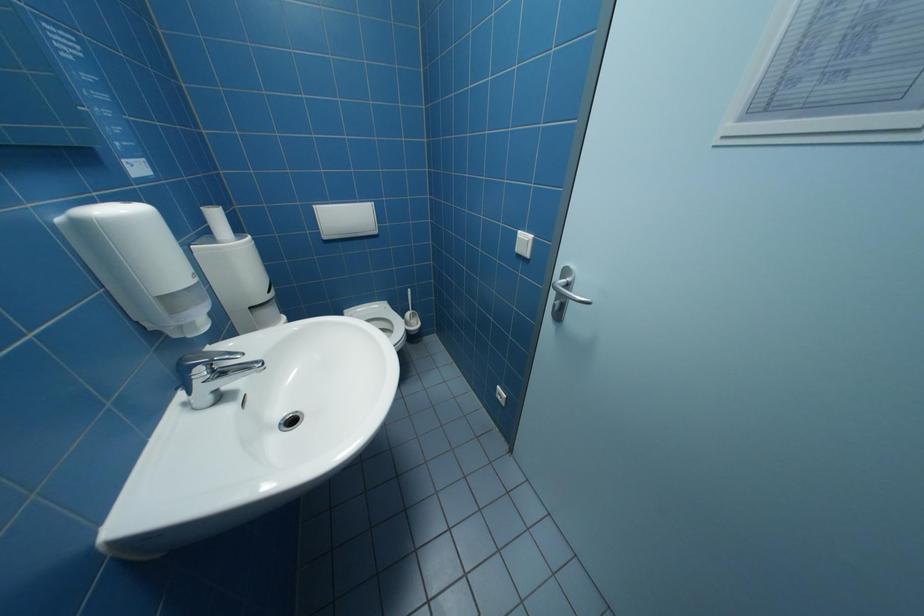
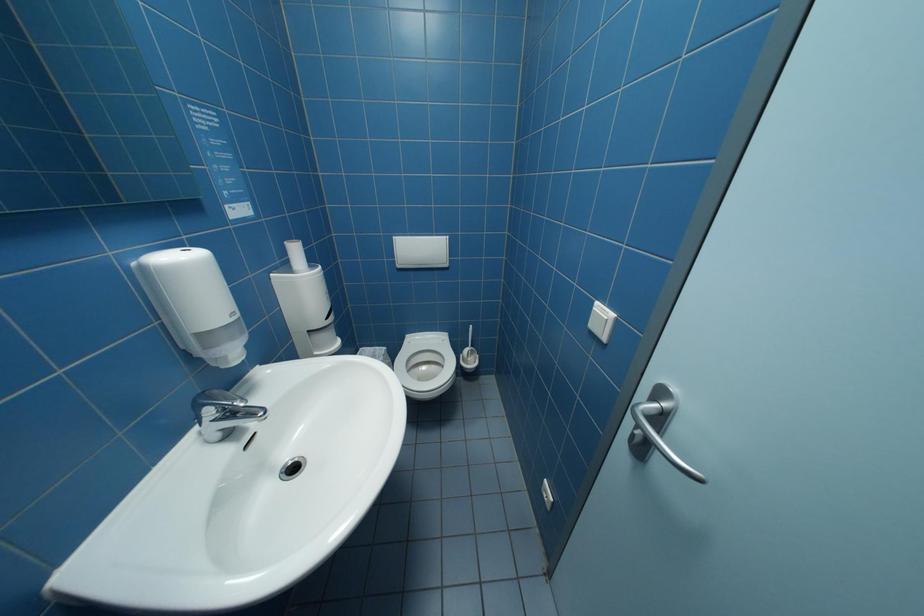
Question: The images are taken continuously from a first-person perspective. In which direction is your viewpoint rotating?

Choices:
 (A) Left
 (B) Right
 (C) Up
 (D) Down

Answer: (A)